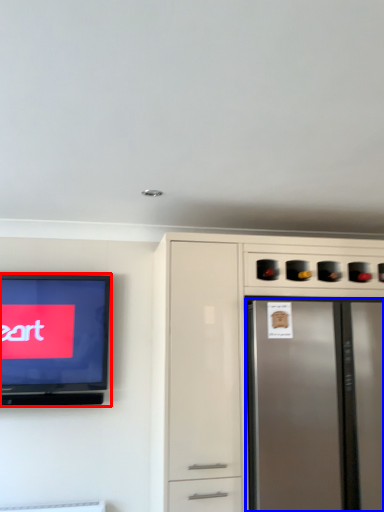
Question: Which object is further to the camera taking this photo, television (highlighted by a red box) or refrigerator (highlighted by a blue box)?

Choices:
 (A) television
 (B) refrigerator

Answer: (A)